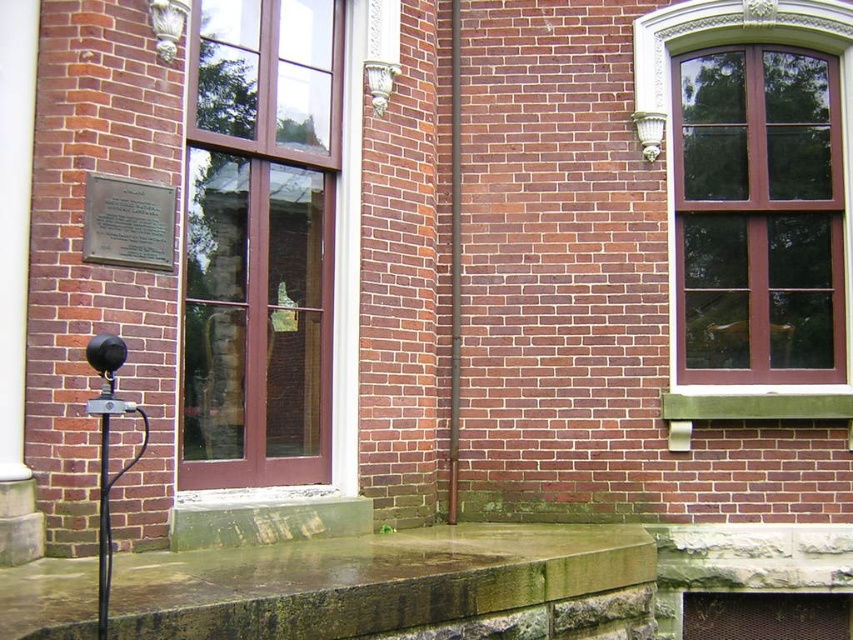
Between point (90, 236) and point (456, 92), which one is positioned behind?

Point (456, 92)

Is metallic plaque at upper left shorter than smooth brown pole at center?

Correct, metallic plaque at upper left is not as tall as smooth brown pole at center.

Which is behind, point (143, 234) or point (457, 387)?

The point (457, 387) is more distant.

At what (x,y) coordinates should I click in order to perform the action: click on metallic plaque at upper left. Please return your answer as a coordinate pair (x, y). The image size is (853, 640). Looking at the image, I should click on (128, 221).

Is green stone ledge at lower center positioned before matte brown window at upper right?

Yes, it is.

Can you confirm if green stone ledge at lower center is positioned below matte brown window at upper right?

Yes.

Is point (496, 609) farther from camera compared to point (654, 99)?

No, (496, 609) is in front of (654, 99).

Find the location of `green stone ledge at lower center`. green stone ledge at lower center is located at coordinates (389, 584).

How distant is matte brown window at upper right from metallic plaque at upper left?

matte brown window at upper right and metallic plaque at upper left are 10.21 feet apart from each other.

Does matte brown window at upper right appear under metallic plaque at upper left?

No.

The width and height of the screenshot is (853, 640). I want to click on matte brown window at upper right, so click(x=671, y=125).